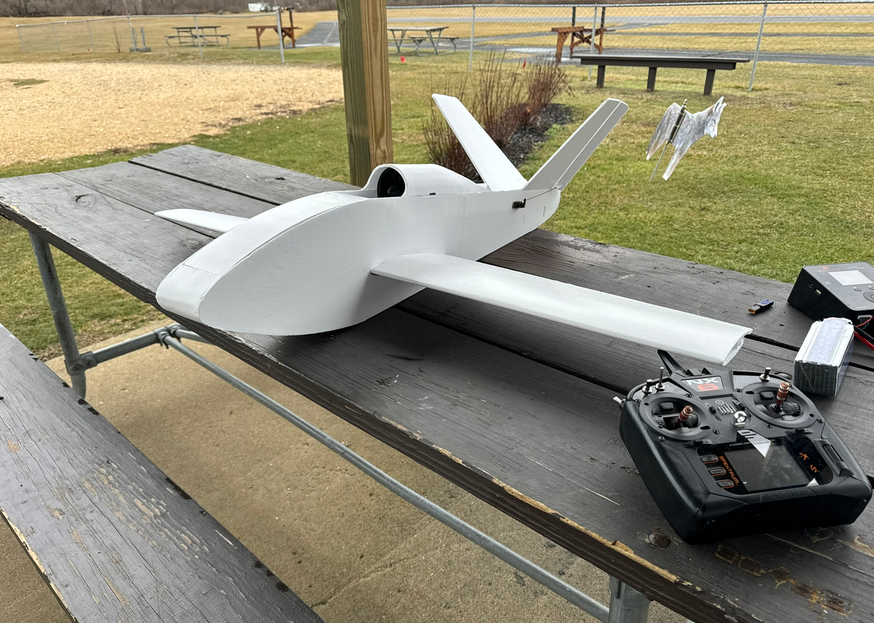
Image resolution: width=874 pixels, height=623 pixels. Find the location of `tables in distance`. tables in distance is located at coordinates (419, 31), (200, 35).